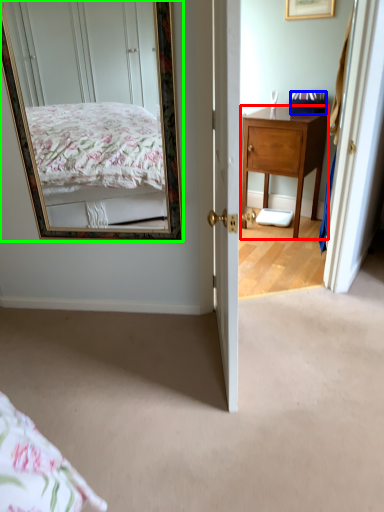
Question: Which object is the closest to the desk (highlighted by a red box)? Choose among these: box (highlighted by a blue box) or mirror (highlighted by a green box).

Choices:
 (A) box
 (B) mirror

Answer: (A)